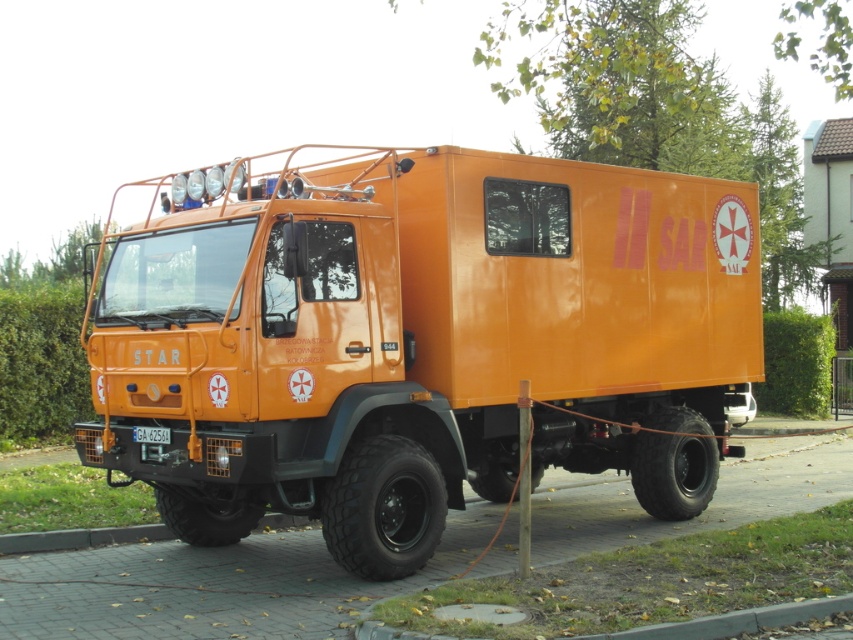
Is orange matte truck at center further to camera compared to white plastic license plate at center?

No, it is in front of white plastic license plate at center.

Looking at this image, does orange matte truck at center have a greater height compared to white plastic license plate at center?

Yes, orange matte truck at center is taller than white plastic license plate at center.

Between point (125, 442) and point (149, 436), which one is positioned in front?

Point (149, 436) is in front.

Locate an element on the screen. This screenshot has height=640, width=853. orange matte truck at center is located at coordinates (422, 340).